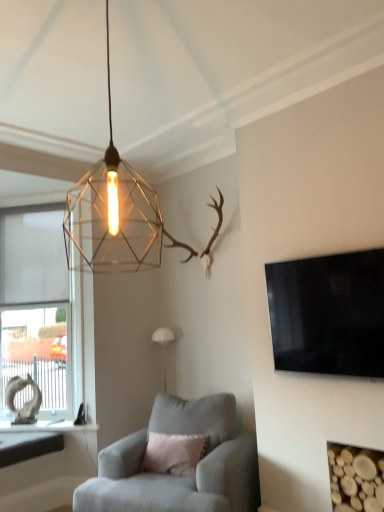
Question: Is suede gray armchair at center shorter than wooden logs at lower right?

Choices:
 (A) no
 (B) yes

Answer: (A)

Question: Is the position of suede gray armchair at center less distant than that of wooden logs at lower right?

Choices:
 (A) no
 (B) yes

Answer: (A)

Question: Is suede gray armchair at center completely or partially outside of wooden logs at lower right?

Choices:
 (A) yes
 (B) no

Answer: (A)

Question: Is suede gray armchair at center surrounding wooden logs at lower right?

Choices:
 (A) yes
 (B) no

Answer: (B)

Question: Is suede gray armchair at center at the right side of wooden logs at lower right?

Choices:
 (A) yes
 (B) no

Answer: (B)

Question: Can you confirm if suede gray armchair at center is wider than wooden logs at lower right?

Choices:
 (A) no
 (B) yes

Answer: (B)

Question: Does metallic wireframe pendant light at upper center, positioned as the 2th lamp in bottom-to-top order, contain black glossy flat-screen tv at right?

Choices:
 (A) yes
 (B) no

Answer: (B)

Question: Is metallic wireframe pendant light at upper center, positioned as the 2th lamp in bottom-to-top order, facing towards black glossy flat-screen tv at right?

Choices:
 (A) yes
 (B) no

Answer: (B)

Question: Is metallic wireframe pendant light at upper center, which is counted as the first lamp, starting from the front, to the right of black glossy flat-screen tv at right from the viewer's perspective?

Choices:
 (A) no
 (B) yes

Answer: (A)

Question: Is metallic wireframe pendant light at upper center, positioned as the 2th lamp in bottom-to-top order, at the left side of black glossy flat-screen tv at right?

Choices:
 (A) yes
 (B) no

Answer: (A)

Question: Is metallic wireframe pendant light at upper center, acting as the 2th lamp starting from the back, further to camera compared to black glossy flat-screen tv at right?

Choices:
 (A) yes
 (B) no

Answer: (B)

Question: From the image's perspective, would you say metallic wireframe pendant light at upper center, which is counted as the first lamp, starting from the front, is positioned over black glossy flat-screen tv at right?

Choices:
 (A) yes
 (B) no

Answer: (A)

Question: Considering the relative positions of black glossy flat-screen tv at right and metallic wireframe pendant light at upper center, positioned as the 2th lamp in bottom-to-top order, in the image provided, is black glossy flat-screen tv at right to the left of metallic wireframe pendant light at upper center, positioned as the 2th lamp in bottom-to-top order, from the viewer's perspective?

Choices:
 (A) no
 (B) yes

Answer: (A)